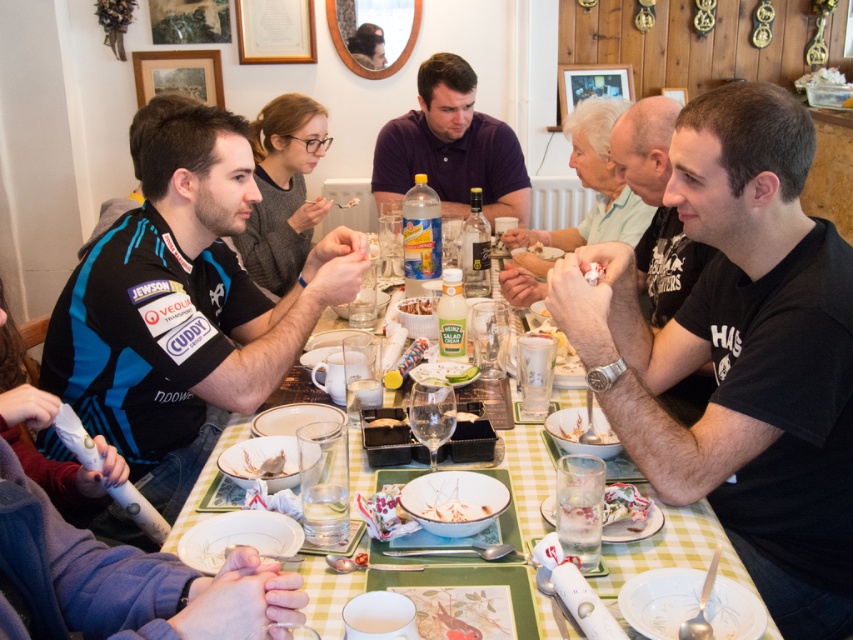
This screenshot has width=853, height=640. Describe the element at coordinates (259, 464) in the screenshot. I see `white matte chicken at center` at that location.

Does white matte chicken at center have a greater width compared to white matte bowl at center?

No, white matte chicken at center is not wider than white matte bowl at center.

What do you see at coordinates (259, 464) in the screenshot? I see `white matte chicken at center` at bounding box center [259, 464].

Where is `white matte chicken at center`? The image size is (853, 640). white matte chicken at center is located at coordinates (259, 464).

Which is more to the left, black jersey at left or white creamy pasta at center?

Positioned to the left is black jersey at left.

Which of these two, black jersey at left or white creamy pasta at center, stands taller?

black jersey at left is taller.

At what (x,y) coordinates should I click in order to perform the action: click on black jersey at left. Please return your answer as a coordinate pair (x, y). The image size is (853, 640). Looking at the image, I should click on [183, 307].

Can you confirm if black jersey at left is bigger than matte gray sweater at center?

Indeed, black jersey at left has a larger size compared to matte gray sweater at center.

Which is more to the right, black jersey at left or matte gray sweater at center?

matte gray sweater at center is more to the right.

This screenshot has height=640, width=853. In order to click on black jersey at left in this screenshot , I will do `click(183, 307)`.

This screenshot has height=640, width=853. Identify the location of black jersey at left. (183, 307).